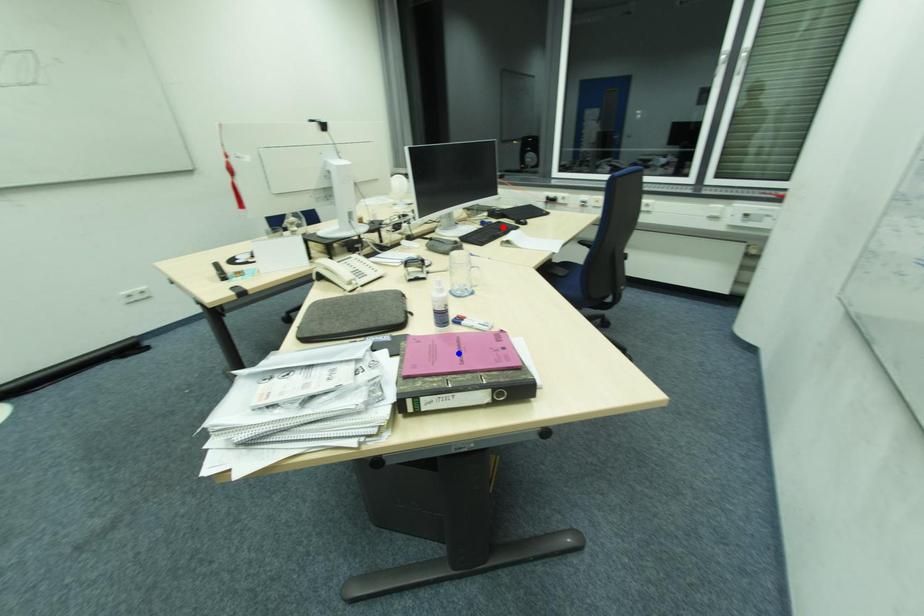
Question: In the image, two points are highlighted. Which point is nearer to the camera? Reply with the corresponding letter.

Choices:
 (A) blue point
 (B) red point

Answer: (A)